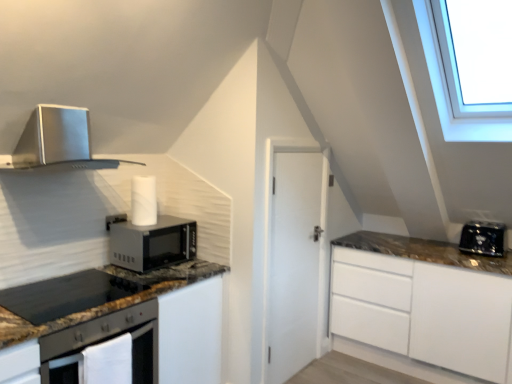
Question: Is black granite gas stove at lower left not close to black plastic toaster at right?

Choices:
 (A) no
 (B) yes

Answer: (B)

Question: From a real-world perspective, is black granite gas stove at lower left positioned under black plastic toaster at right based on gravity?

Choices:
 (A) yes
 (B) no

Answer: (A)

Question: Is black granite gas stove at lower left aimed at black plastic toaster at right?

Choices:
 (A) no
 (B) yes

Answer: (A)

Question: Can you confirm if black granite gas stove at lower left is bigger than black plastic toaster at right?

Choices:
 (A) yes
 (B) no

Answer: (B)

Question: Is black granite gas stove at lower left oriented away from black plastic toaster at right?

Choices:
 (A) yes
 (B) no

Answer: (B)

Question: From the image's perspective, is satin silver range hood at upper left above or below metallic matte microwave oven at center-left?

Choices:
 (A) below
 (B) above

Answer: (B)

Question: Is satin silver range hood at upper left bigger or smaller than metallic matte microwave oven at center-left?

Choices:
 (A) big
 (B) small

Answer: (A)

Question: From a real-world perspective, is satin silver range hood at upper left physically located above or below metallic matte microwave oven at center-left?

Choices:
 (A) above
 (B) below

Answer: (A)

Question: Considering the positions of satin silver range hood at upper left and metallic matte microwave oven at center-left in the image, is satin silver range hood at upper left taller or shorter than metallic matte microwave oven at center-left?

Choices:
 (A) tall
 (B) short

Answer: (A)

Question: From the image's perspective, relative to satin silver range hood at upper left, is black granite gas stove at lower left above or below?

Choices:
 (A) above
 (B) below

Answer: (B)

Question: Considering their positions, is black granite gas stove at lower left located in front of or behind satin silver range hood at upper left?

Choices:
 (A) front
 (B) behind

Answer: (A)

Question: Considering the positions of black granite gas stove at lower left and satin silver range hood at upper left in the image, is black granite gas stove at lower left bigger or smaller than satin silver range hood at upper left?

Choices:
 (A) small
 (B) big

Answer: (A)

Question: In terms of width, does black granite gas stove at lower left look wider or thinner when compared to satin silver range hood at upper left?

Choices:
 (A) thin
 (B) wide

Answer: (B)

Question: Is black granite countertop at lower left in front of or behind black plastic toaster at right in the image?

Choices:
 (A) behind
 (B) front

Answer: (B)

Question: In terms of height, does black granite countertop at lower left look taller or shorter compared to black plastic toaster at right?

Choices:
 (A) tall
 (B) short

Answer: (A)